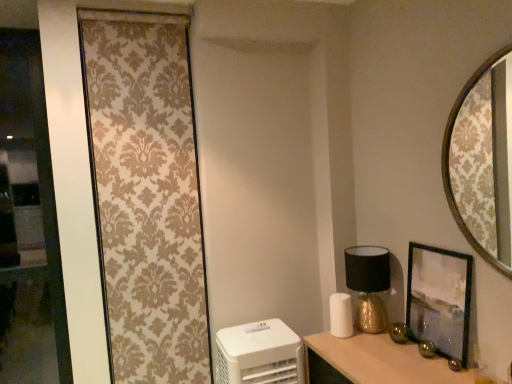
Question: Is matte black picture frame at right in front of or behind white plastic air purifier at lower left in the image?

Choices:
 (A) front
 (B) behind

Answer: (A)

Question: In the image, is matte black picture frame at right on the left side or the right side of white plastic air purifier at lower left?

Choices:
 (A) left
 (B) right

Answer: (B)

Question: Estimate the real-world distances between objects in this image. Which object is closer to the white plastic air purifier at lower left?

Choices:
 (A) black matte/golden table lamp at right
 (B) beige damask curtain at left
 (C) matte black picture frame at right
 (D) transparent glass door at left
 (E) wooden frame mirror at upper right

Answer: (A)

Question: Which is nearer to the matte black picture frame at right?

Choices:
 (A) wooden frame mirror at upper right
 (B) transparent glass door at left
 (C) beige damask curtain at left
 (D) white plastic air purifier at lower left
 (E) black matte/golden table lamp at right

Answer: (E)